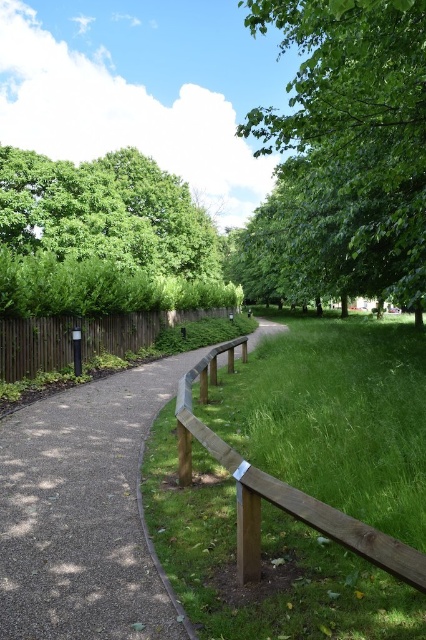
You are planning to walk along the path and need to know the space available between the green grass at center and the brown wooden fence at left. Which one is wider?

The green grass at center is wider than the brown wooden fence at left according to the description.

You are standing on the paved pathway in the park and want to reach the green grass at center. Which direction should you move to get there from the brown wooden fence at left?

The green grass at center is below the brown wooden fence at left, so you should move downward towards the green grass at center to reach it.

You are planning to plant a small garden in the park. You have two areas to choose from, the green grass at center and the brown gravel path at center. Which area has a larger space for planting?

The green grass at center is bigger than the brown gravel path at center, so the green grass at center provides a larger space for planting.